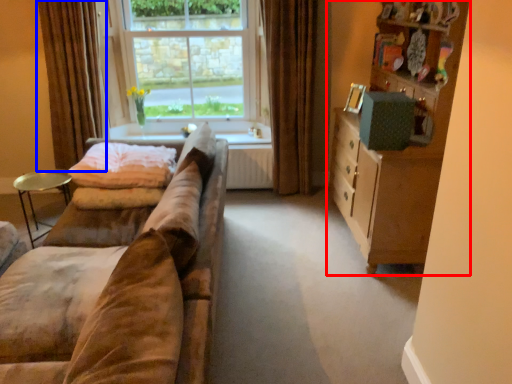
Question: Which object appears closest to the camera in this image, cabinetry (highlighted by a red box) or curtain (highlighted by a blue box)?

Choices:
 (A) cabinetry
 (B) curtain

Answer: (A)